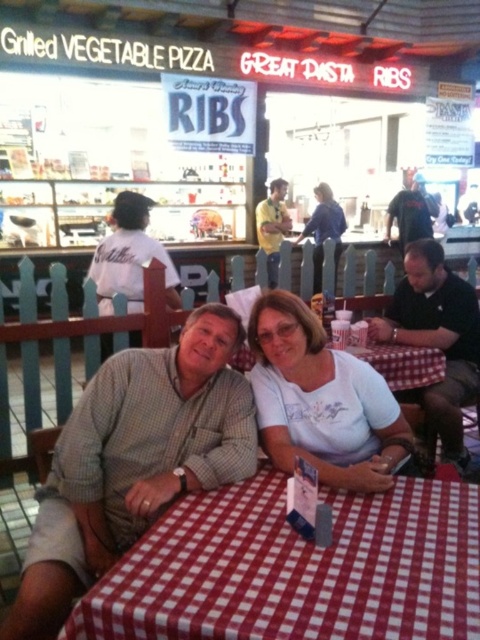
You are a photographer trying to capture both the checkered shirt at center and the blue denim shirt at center in a single shot. Which shirt will appear larger in the photo?

The checkered shirt at center will appear larger in the photo because it is closer to the viewer than the blue denim shirt at center.

Looking at this image, you are a photographer taking a picture of the two diners. You notice two points in the background that might be distracting. The first point is at coordinate point(211, 538) and the second is at point(223, 465). Which point is closer to the camera and therefore more likely to appear in focus if you focus on the diners?

Point(211, 538) is closer to the camera than point(223, 465), so it will be more likely to appear in focus if you focus on the diners.

You are a waiter at the barbecue restaurant and need to place a new order of drinks on the table. The drinks must be placed exactly at the coordinates given by the kitchen staff, which is point (297, 568). Where on the red checkered tablecloth at center should you place the drinks?

The point (297, 568) is located on the red checkered tablecloth at center, so you should place the drinks exactly at that coordinate on the red checkered tablecloth at center.